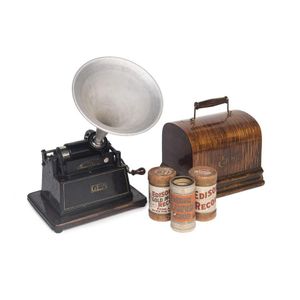
Find the location of a particular element. The width and height of the screenshot is (300, 300). handle is located at coordinates (200, 104).